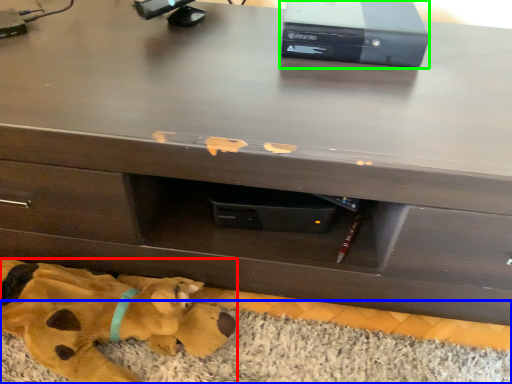
Question: Which object is positioned closest to toy (highlighted by a red box)? Select from mat (highlighted by a blue box) and computer (highlighted by a green box).

Choices:
 (A) mat
 (B) computer

Answer: (A)